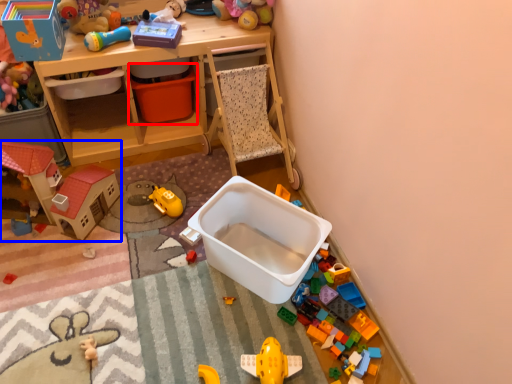
Question: Which object is closer to the camera taking this photo, storage box (highlighted by a red box) or toy (highlighted by a blue box)?

Choices:
 (A) storage box
 (B) toy

Answer: (B)